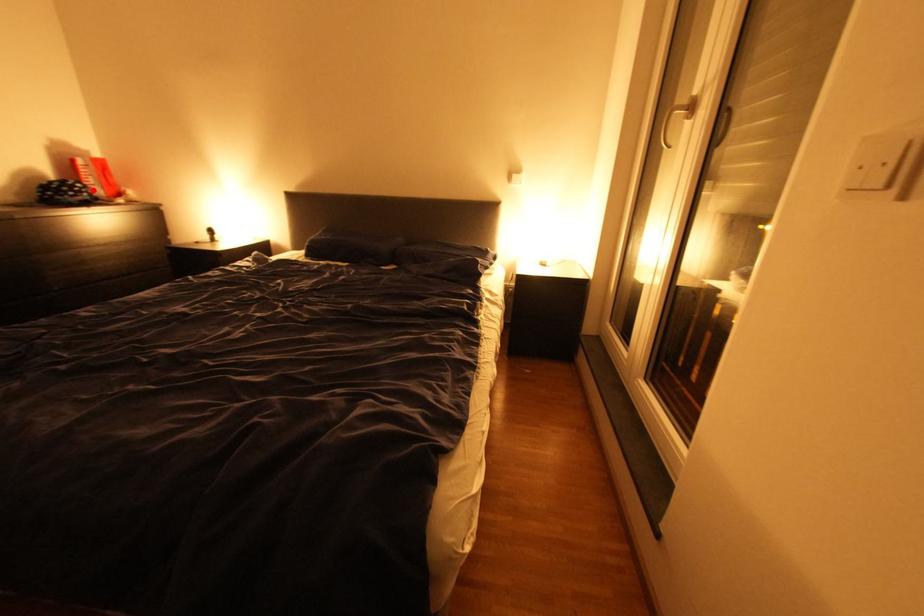
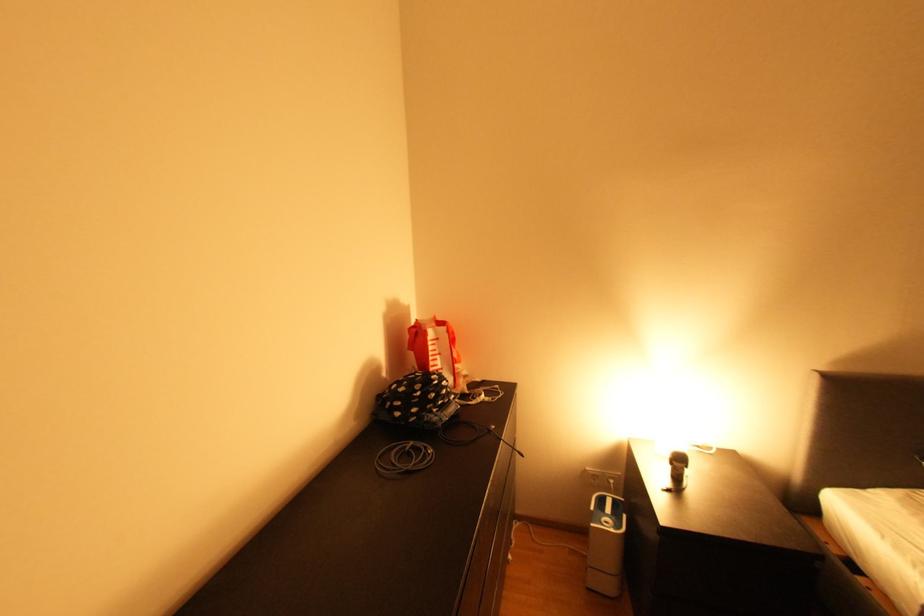
Question: I am providing you with two images of the same scene from different viewpoints. Image1 has a red point marked. In image2, the corresponding 3D location appears at what relative position? Reply with the corresponding letter.

Choices:
 (A) Closer
 (B) Farther

Answer: (A)